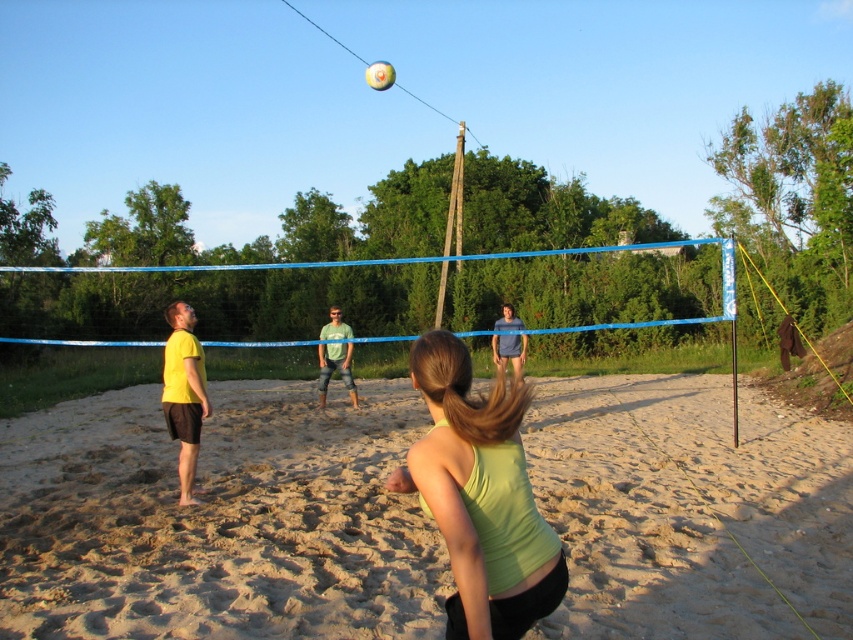
Who is lower down, green matte shirt at center or white matte volleyball at upper center?

Positioned lower is green matte shirt at center.

In the scene shown: Who is taller, green matte shirt at center or white matte volleyball at upper center?

white matte volleyball at upper center

Between point (320, 392) and point (392, 72), which one is positioned behind?

The point (392, 72) is behind.

Identify the location of green matte shirt at center. (334, 369).

Which is above, green matte tank top at center or green matte shirt at center?

green matte shirt at center is above.

Does green matte tank top at center appear on the left side of green matte shirt at center?

Incorrect, green matte tank top at center is not on the left side of green matte shirt at center.

At what (x,y) coordinates should I click in order to perform the action: click on green matte tank top at center. Please return your answer as a coordinate pair (x, y). The image size is (853, 640). Looking at the image, I should click on (480, 497).

At what (x,y) coordinates should I click in order to perform the action: click on green matte tank top at center. Please return your answer as a coordinate pair (x, y). The image size is (853, 640). Looking at the image, I should click on (480, 497).

Is yellow matte shirt at left taller than green matte shirt at center?

Incorrect, yellow matte shirt at left's height is not larger of green matte shirt at center's.

Does yellow matte shirt at left have a lesser height compared to green matte shirt at center?

Indeed, yellow matte shirt at left has a lesser height compared to green matte shirt at center.

This screenshot has width=853, height=640. Describe the element at coordinates (184, 394) in the screenshot. I see `yellow matte shirt at left` at that location.

Where is `yellow matte shirt at left`? This screenshot has width=853, height=640. yellow matte shirt at left is located at coordinates (184, 394).